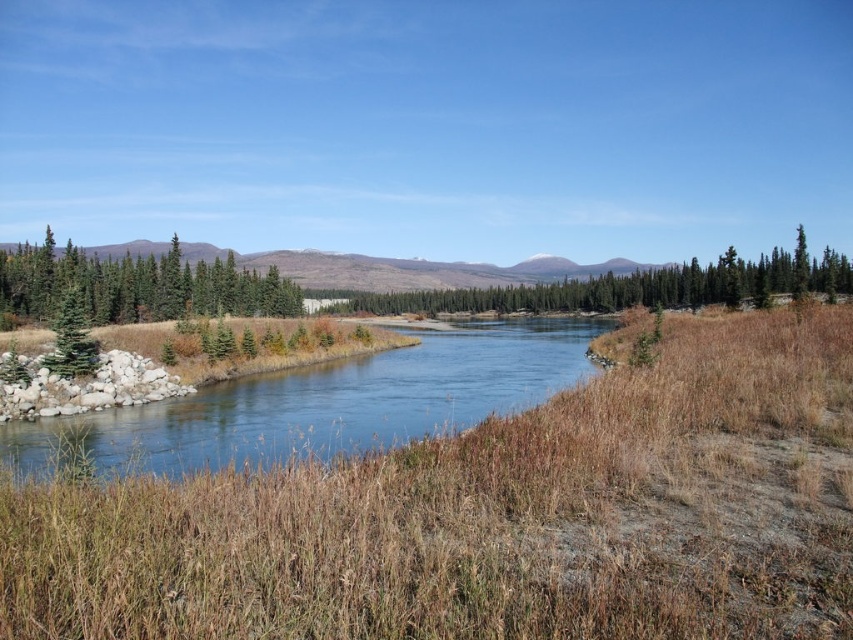
Is brown dry grass at center shorter than green matte evergreen tree at left?

Correct, brown dry grass at center is not as tall as green matte evergreen tree at left.

Between point (403, 634) and point (56, 330), which one is positioned in front?

Positioned in front is point (403, 634).

The width and height of the screenshot is (853, 640). Identify the location of brown dry grass at center. (492, 516).

Does green textured trees at center have a smaller size compared to green matte evergreen tree at left?

No, green textured trees at center is not smaller than green matte evergreen tree at left.

Describe the element at coordinates (633, 288) in the screenshot. This screenshot has height=640, width=853. I see `green textured trees at center` at that location.

Locate an element on the screen. Image resolution: width=853 pixels, height=640 pixels. green textured trees at center is located at coordinates (633, 288).

Where is `green textured trees at center`? This screenshot has width=853, height=640. green textured trees at center is located at coordinates (633, 288).

Is brown dry grass at center to the left of green textured trees at center from the viewer's perspective?

Correct, you'll find brown dry grass at center to the left of green textured trees at center.

Does point (669, 392) come in front of point (572, 280)?

Yes.

Locate an element on the screen. This screenshot has width=853, height=640. brown dry grass at center is located at coordinates (492, 516).